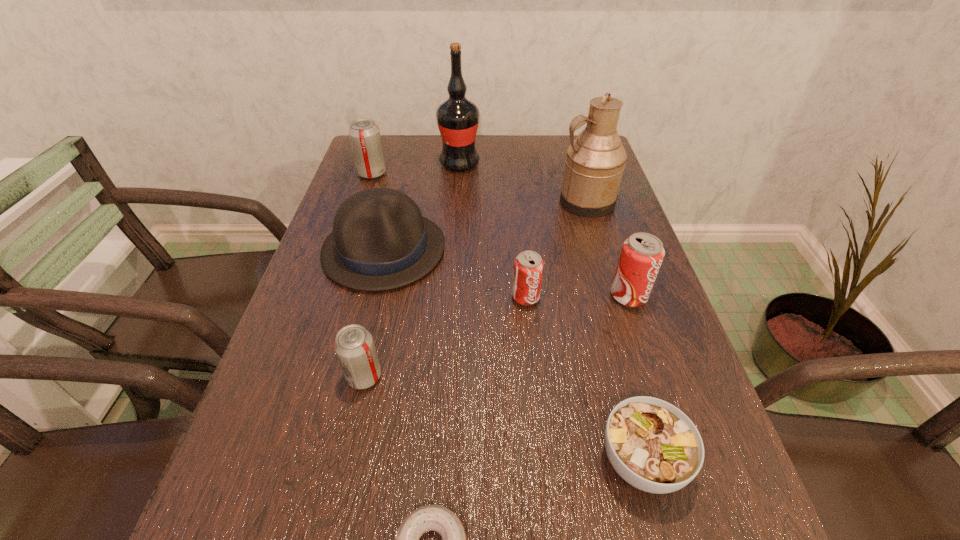
Where is `free spot located on the left of the second shortest object`? The width and height of the screenshot is (960, 540). free spot located on the left of the second shortest object is located at coordinates (380, 461).

Identify the location of wine bottle located in the far edge section of the desktop. (457, 118).

Locate an element on the screen. The height and width of the screenshot is (540, 960). soda can at the far edge is located at coordinates (364, 134).

What are the coordinates of `bowler hat that is at the left edge` in the screenshot? It's located at (380, 241).

Identify the location of pitcher that is at the right edge. (595, 160).

Locate an element on the screen. The image size is (960, 540). soda can present at the right edge is located at coordinates (642, 254).

Find the location of `soup bowl at the right edge`. soup bowl at the right edge is located at coordinates (655, 447).

Where is `object present at the far left corner`? The height and width of the screenshot is (540, 960). object present at the far left corner is located at coordinates (364, 134).

Find the location of `vacant space at the far edge of the desktop`. vacant space at the far edge of the desktop is located at coordinates (411, 147).

In the image, there is a desktop. Where is `free space at the left edge`? free space at the left edge is located at coordinates (386, 175).